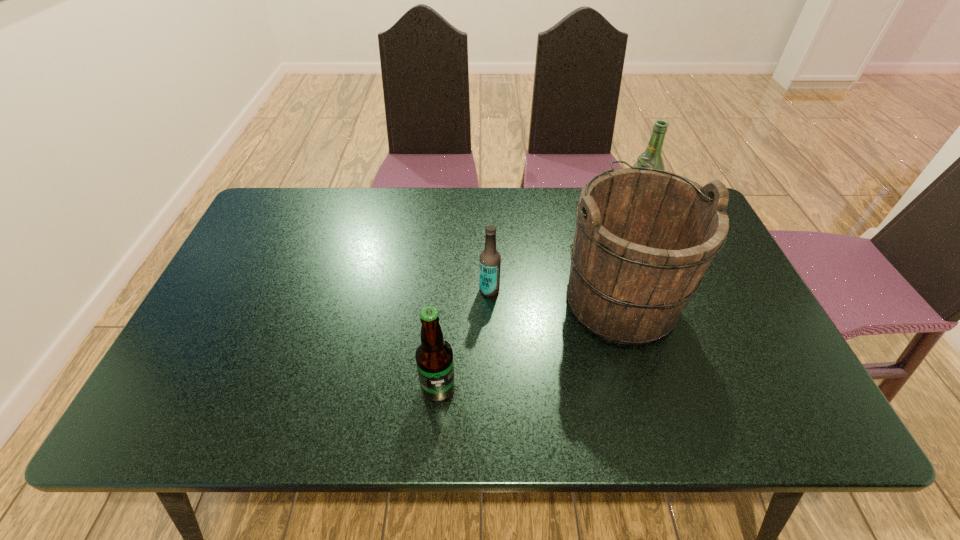
Image resolution: width=960 pixels, height=540 pixels. In order to click on free point between the tallest object and the nearest beer bottle in this screenshot , I will do `click(529, 343)`.

Where is `free spot between the tallest object and the shortest object`? The image size is (960, 540). free spot between the tallest object and the shortest object is located at coordinates click(555, 294).

Locate an element on the screen. The image size is (960, 540). free area in between the bucket and the leftmost object is located at coordinates (529, 343).

What are the coordinates of `vacant area that lies between the farthest object and the nearest beer bottle` in the screenshot? It's located at (538, 298).

Locate an element on the screen. free point between the tallest object and the leftmost beer bottle is located at coordinates (529, 343).

Where is `the third closest object to the nearest beer bottle`? The image size is (960, 540). the third closest object to the nearest beer bottle is located at coordinates (651, 158).

At what (x,y) coordinates should I click in order to perform the action: click on object that is the third closest to the bucket. Please return your answer as a coordinate pair (x, y). Image resolution: width=960 pixels, height=540 pixels. Looking at the image, I should click on (434, 355).

Identify the location of beer bottle object that ranks as the closest to the leftmost beer bottle. (490, 260).

The image size is (960, 540). I want to click on beer bottle that can be found as the closest to the nearest beer bottle, so click(x=490, y=260).

Locate an element on the screen. free space that satisfies the following two spatial constraints: 1. on the surface of the farthest object; 2. on the label of the nearest beer bottle is located at coordinates (709, 388).